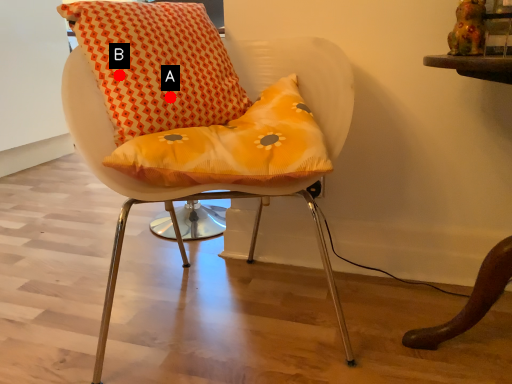
Question: Two points are circled on the image, labeled by A and B beside each circle. Among these points, which one is farthest from the camera?

Choices:
 (A) A is further
 (B) B is further

Answer: (A)